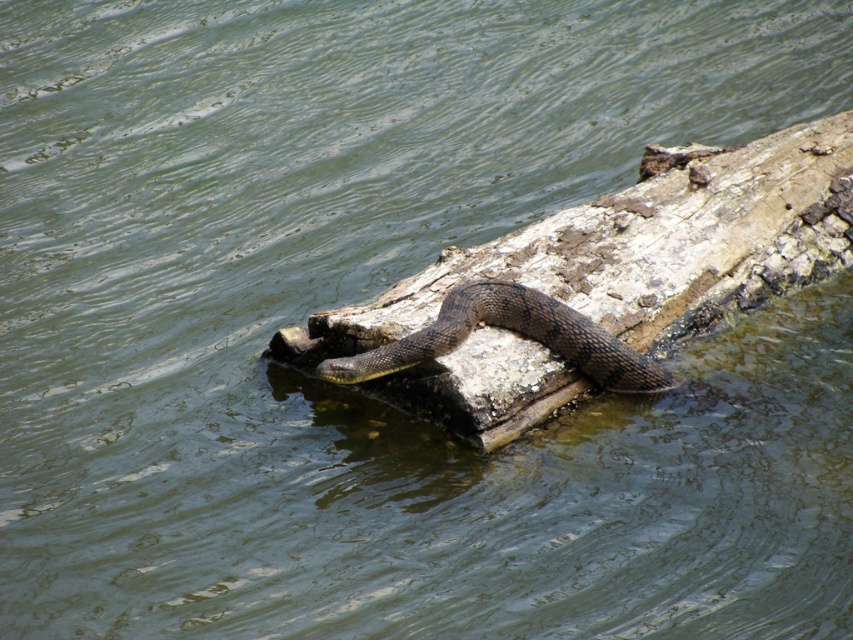
Question: Does brown rough wood log at center have a smaller size compared to brown scaly snake at center?

Choices:
 (A) no
 (B) yes

Answer: (A)

Question: Which of the following is the farthest from the observer?

Choices:
 (A) brown rough wood log at center
 (B) brown scaly snake at center

Answer: (B)

Question: Which object appears farthest from the camera in this image?

Choices:
 (A) brown scaly snake at center
 (B) brown rough wood log at center

Answer: (A)

Question: Where is brown rough wood log at center located in relation to brown scaly snake at center in the image?

Choices:
 (A) left
 (B) right

Answer: (B)

Question: Which object is farther from the camera taking this photo?

Choices:
 (A) brown scaly snake at center
 (B) brown rough wood log at center

Answer: (A)

Question: Is brown rough wood log at center smaller than brown scaly snake at center?

Choices:
 (A) yes
 (B) no

Answer: (B)